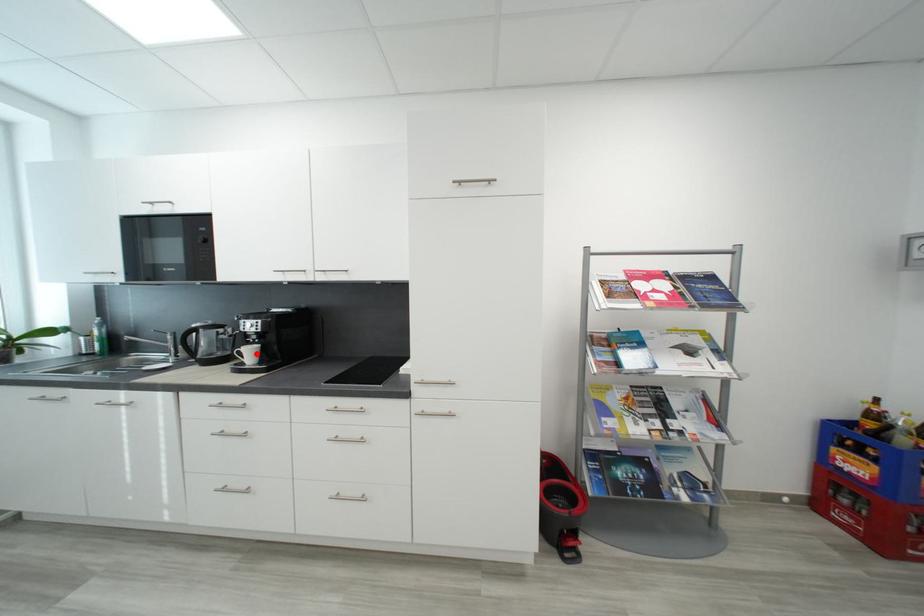
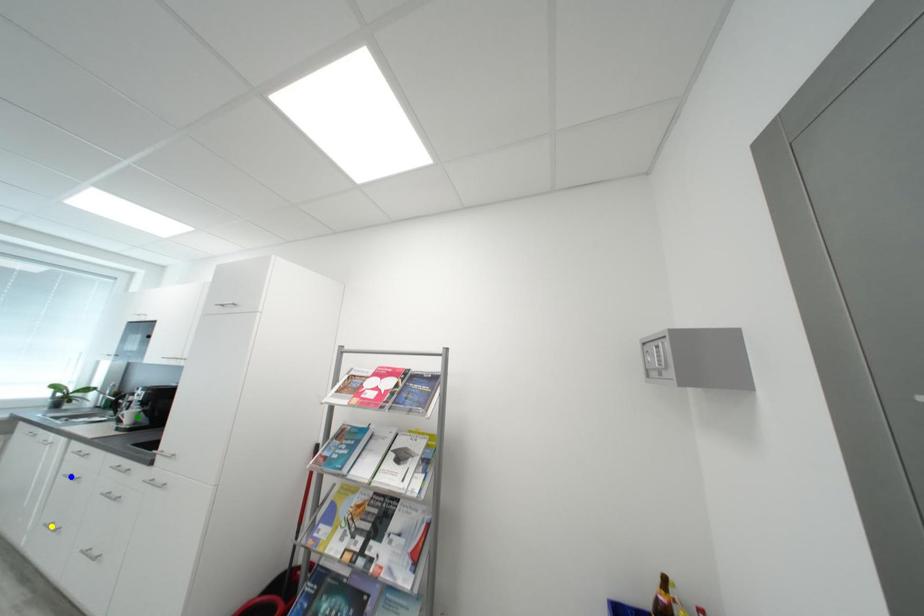
Question: I am providing you with two images of the same scene from different viewpoints. A red point is marked on the first image. You are given multiple points on the second image. Which spot in image 2 lines up with the point in image 1?

Choices:
 (A) yellow point
 (B) blue point
 (C) green point

Answer: (C)